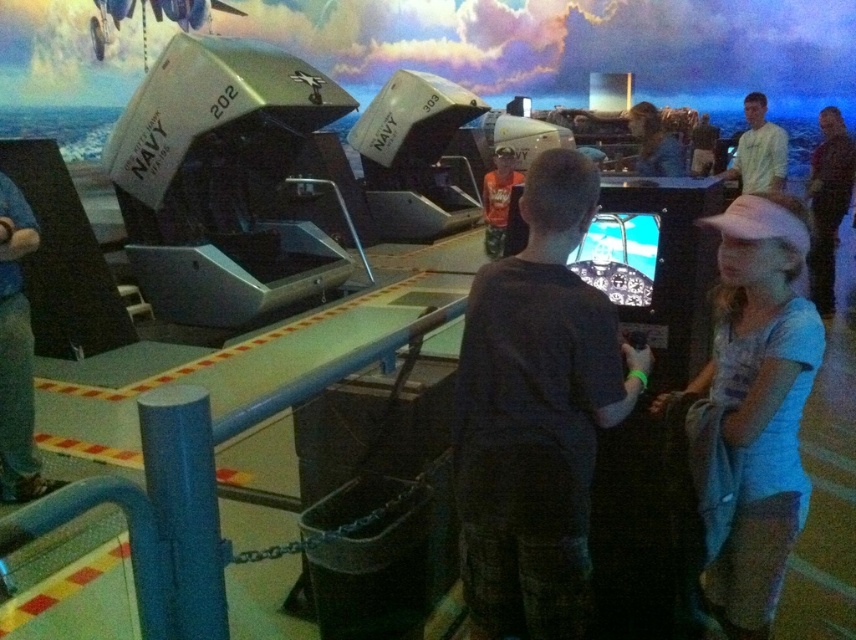
Question: Can you confirm if dark gray shirt at center is positioned to the right of white t-shirt at upper right?

Choices:
 (A) yes
 (B) no

Answer: (B)

Question: Which of the following is the farthest from the observer?

Choices:
 (A) dark gray shirt at center
 (B) white t-shirt at upper right

Answer: (B)

Question: Does dark gray shirt at center have a larger size compared to white t-shirt at upper right?

Choices:
 (A) no
 (B) yes

Answer: (A)

Question: Which point is farther to the camera?

Choices:
 (A) dark gray shirt at center
 (B) white t-shirt at upper right

Answer: (B)

Question: Is dark gray shirt at center wider than white t-shirt at upper right?

Choices:
 (A) yes
 (B) no

Answer: (A)